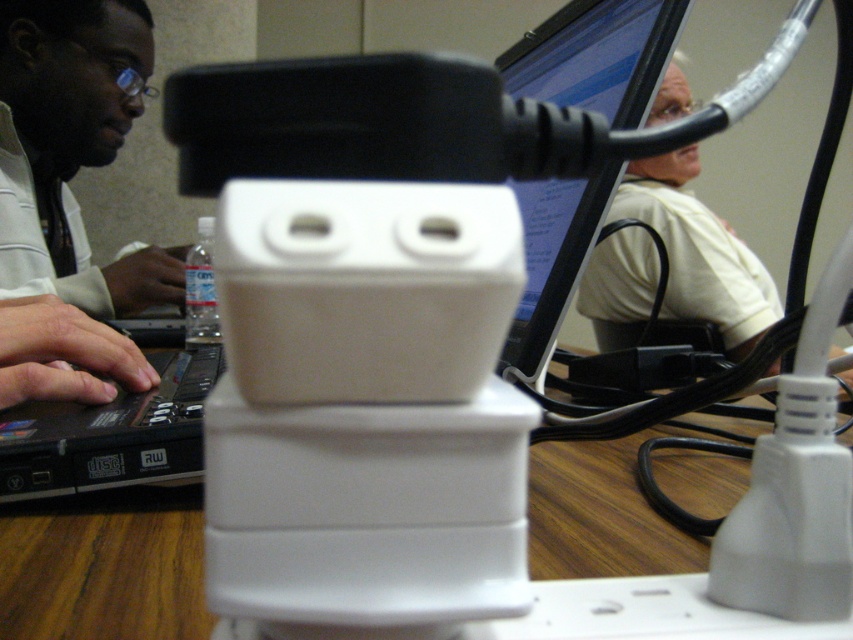
Is matte black laptop at left above wooden table at center?

Indeed, matte black laptop at left is positioned over wooden table at center.

Does point (18, 195) come behind point (78, 612)?

Yes, point (18, 195) is farther from viewer.

In order to click on matte black laptop at left in this screenshot , I will do `click(73, 147)`.

Does white matte shirt at upper right appear on the left side of wooden table at center?

No, white matte shirt at upper right is not to the left of wooden table at center.

This screenshot has height=640, width=853. In order to click on white matte shirt at upper right in this screenshot , I will do `click(698, 252)`.

At what (x,y) coordinates should I click in order to perform the action: click on white matte shirt at upper right. Please return your answer as a coordinate pair (x, y). The width and height of the screenshot is (853, 640). Looking at the image, I should click on (698, 252).

Is point (728, 234) positioned after point (106, 326)?

Yes, point (728, 234) is farther from viewer.

Is point (641, 259) in front of point (57, 348)?

No, it is behind (57, 348).

The height and width of the screenshot is (640, 853). Identify the location of white matte shirt at upper right. (698, 252).